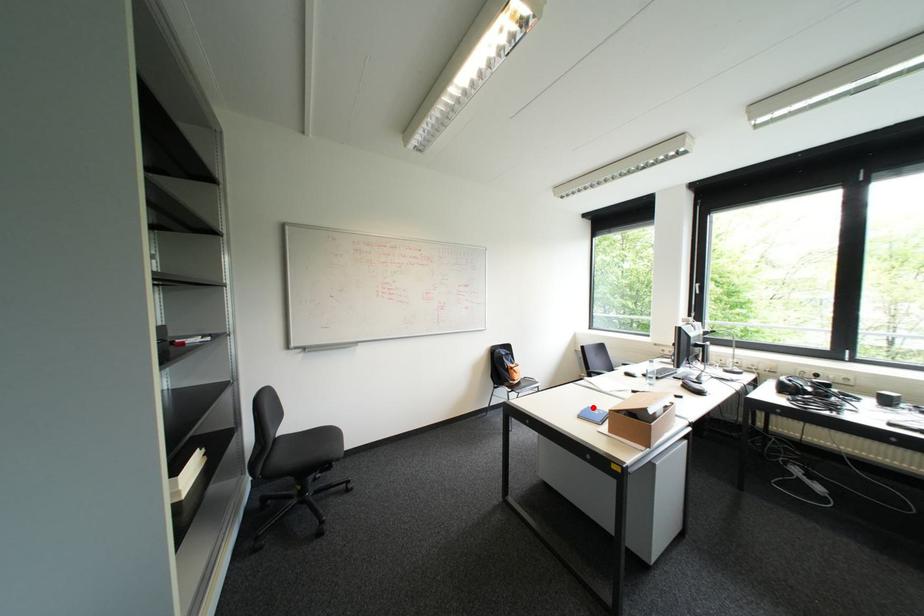
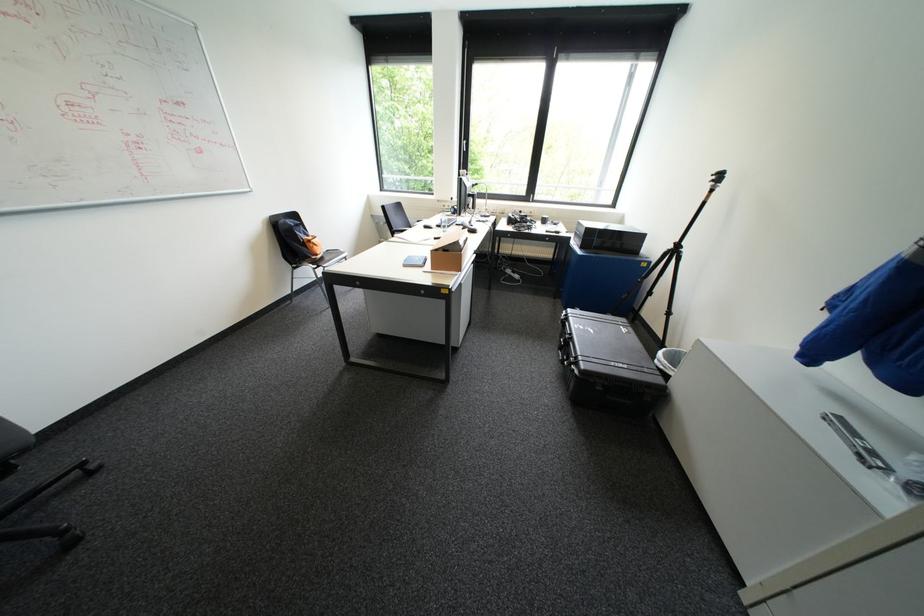
The point at the highlighted location is marked in the first image. Where is the corresponding point in the second image?

(415, 257)